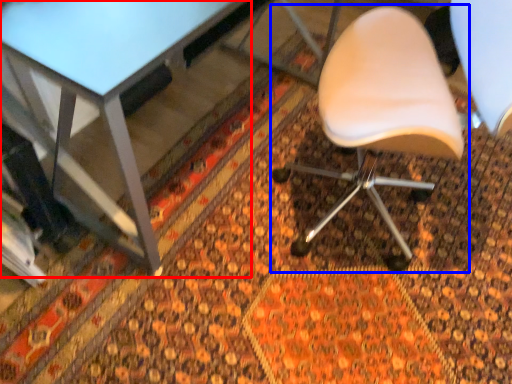
Question: Among these objects, which one is farthest to the camera, table (highlighted by a red box) or chair (highlighted by a blue box)?

Choices:
 (A) table
 (B) chair

Answer: (A)